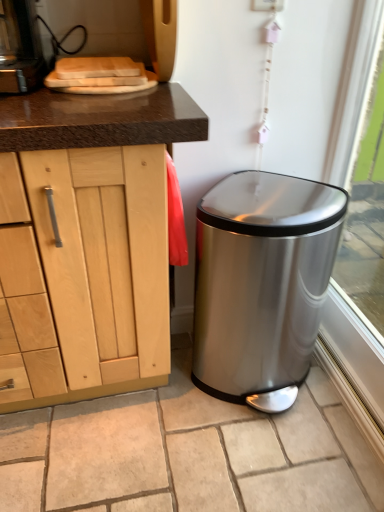
This screenshot has width=384, height=512. I want to click on free space above satin silver trash can at lower right (from a real-world perspective), so click(178, 435).